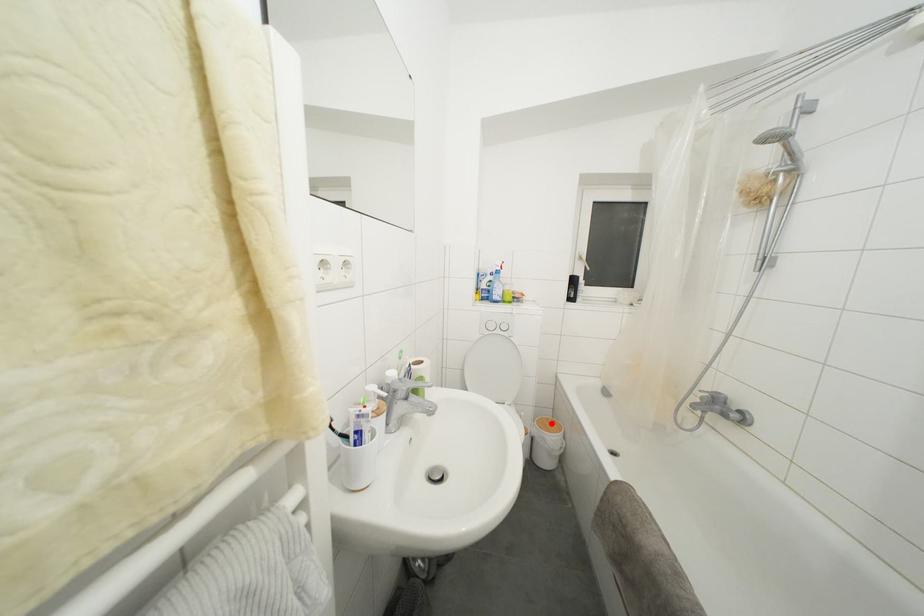
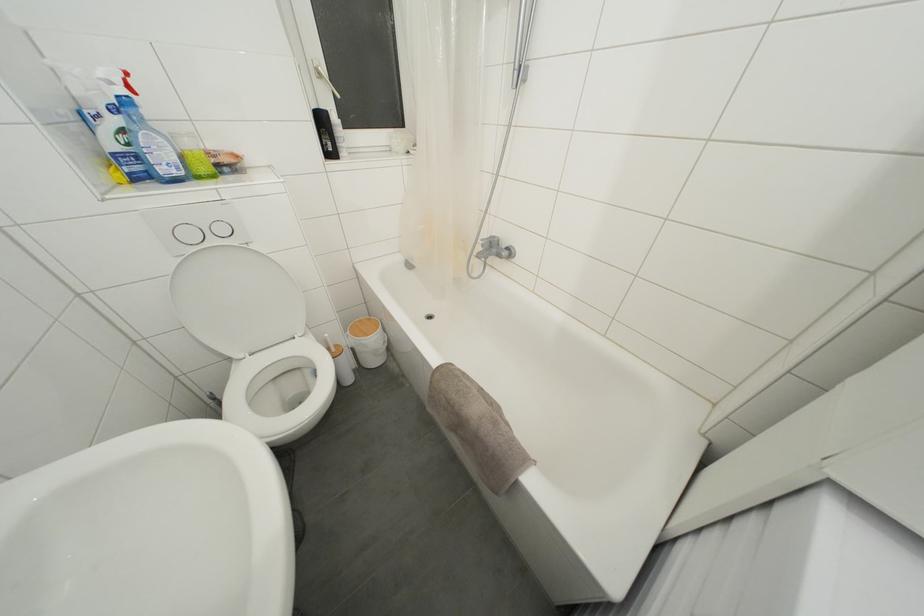
The point at the highlighted location is marked in the first image. Where is the corresponding point in the second image?

(363, 326)